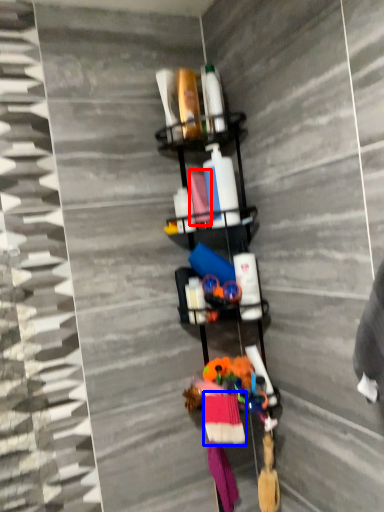
Question: Which object is closer to the camera taking this photo, fabric (highlighted by a red box) or clothing (highlighted by a blue box)?

Choices:
 (A) fabric
 (B) clothing

Answer: (B)